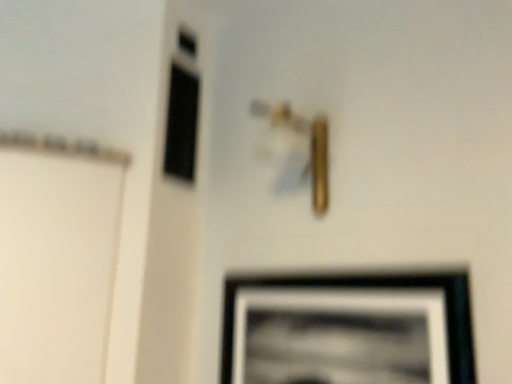
In order to face black glass window at upper left, should I rotate leftwards or rightwards?

You should look left and rotate roughly 9.140 degrees.

Where is `gold metallic door handle at center`? This screenshot has height=384, width=512. gold metallic door handle at center is located at coordinates (311, 145).

What's the angular difference between gold metallic door handle at center and black matte picture frame at lower right's facing directions?

The angle between the facing direction of gold metallic door handle at center and the facing direction of black matte picture frame at lower right is 0.00155 degrees.

Is gold metallic door handle at center taller than black matte picture frame at lower right?

No, gold metallic door handle at center is not taller than black matte picture frame at lower right.

Is black matte picture frame at lower right at the back of gold metallic door handle at center?

No, black matte picture frame at lower right is not at the back of gold metallic door handle at center.

Is gold metallic door handle at center far from black matte picture frame at lower right?

No, gold metallic door handle at center is in close proximity to black matte picture frame at lower right.

From the image's perspective, is gold metallic door handle at center above or below black glass window at upper left?

From the image's perspective, gold metallic door handle at center appears below black glass window at upper left.

Locate an element on the screen. Image resolution: width=512 pixels, height=384 pixels. door handle in front of the black glass window at upper left is located at coordinates (311, 145).

Considering the relative positions of gold metallic door handle at center and black glass window at upper left in the image provided, is gold metallic door handle at center behind black glass window at upper left?

No, gold metallic door handle at center is closer to the viewer.

Between gold metallic door handle at center and black glass window at upper left, which one has larger width?

Wider between the two is gold metallic door handle at center.

From a real-world perspective, which object stands above the other?

black glass window at upper left is physically above.

In the scene shown: Is black matte picture frame at lower right not near black glass window at upper left?

No, black matte picture frame at lower right is not far away from black glass window at upper left.

From the image's perspective, is black matte picture frame at lower right positioned above or below black glass window at upper left?

Clearly, from the image's perspective, black matte picture frame at lower right is below black glass window at upper left.

Considering the positions of objects black glass window at upper left and gold metallic door handle at center in the image provided, who is in front, black glass window at upper left or gold metallic door handle at center?

gold metallic door handle at center is closer to the camera.

Does point (173, 126) appear closer or farther from the camera than point (268, 108)?

Point (173, 126) appears to be farther away from the viewer than point (268, 108).

Measure the distance from black glass window at upper left to gold metallic door handle at center.

15.18 inches.

From the image's perspective, is black glass window at upper left over gold metallic door handle at center?

Yes, from the image's perspective, black glass window at upper left is on top of gold metallic door handle at center.

Is black glass window at upper left completely or partially outside of black matte picture frame at lower right?

That's correct, black glass window at upper left is outside of black matte picture frame at lower right.

Consider the image. Considering the relative sizes of black glass window at upper left and black matte picture frame at lower right in the image provided, is black glass window at upper left bigger than black matte picture frame at lower right?

No, black glass window at upper left is not bigger than black matte picture frame at lower right.

How many degrees apart are the facing directions of black glass window at upper left and black matte picture frame at lower right?

The angular difference between black glass window at upper left and black matte picture frame at lower right is 87.9 degrees.

Measure the distance from black glass window at upper left to black matte picture frame at lower right.

A distance of 31.14 inches exists between black glass window at upper left and black matte picture frame at lower right.

The width and height of the screenshot is (512, 384). I want to click on picture frame located underneath the gold metallic door handle at center (from a real-world perspective), so click(348, 329).

Who is taller, black matte picture frame at lower right or gold metallic door handle at center?

black matte picture frame at lower right.

From a real-world perspective, is black matte picture frame at lower right positioned over gold metallic door handle at center based on gravity?

No, from a real-world perspective, black matte picture frame at lower right is not over gold metallic door handle at center

From the image's perspective, is black matte picture frame at lower right beneath gold metallic door handle at center?

Yes, from the image's perspective, black matte picture frame at lower right is beneath gold metallic door handle at center.

The image size is (512, 384). Find the location of `door handle on the left of black matte picture frame at lower right`. door handle on the left of black matte picture frame at lower right is located at coordinates (311, 145).

Find the location of a particular element. Image resolution: width=512 pixels, height=384 pixels. door handle in front of the black glass window at upper left is located at coordinates (311, 145).

Estimate the real-world distances between objects in this image. Which object is closer to gold metallic door handle at center, black matte picture frame at lower right or black glass window at upper left?

Based on the image, black glass window at upper left appears to be nearer to gold metallic door handle at center.

Based on their spatial positions, is black matte picture frame at lower right or gold metallic door handle at center closer to black glass window at upper left?

gold metallic door handle at center is closer to black glass window at upper left.

Estimate the real-world distances between objects in this image. Which object is closer to black glass window at upper left, gold metallic door handle at center or black matte picture frame at lower right?

gold metallic door handle at center is closer to black glass window at upper left.

Which object lies nearer to the anchor point gold metallic door handle at center, black glass window at upper left or black matte picture frame at lower right?

→ black glass window at upper left.

Which object lies further to the anchor point black matte picture frame at lower right, black glass window at upper left or gold metallic door handle at center?

Among the two, black glass window at upper left is located further to black matte picture frame at lower right.

When comparing their distances from black matte picture frame at lower right, does gold metallic door handle at center or black glass window at upper left seem closer?

Based on the image, gold metallic door handle at center appears to be nearer to black matte picture frame at lower right.

Locate an element on the screen. The width and height of the screenshot is (512, 384). door handle between black glass window at upper left and black matte picture frame at lower right in the up-down direction is located at coordinates (311, 145).